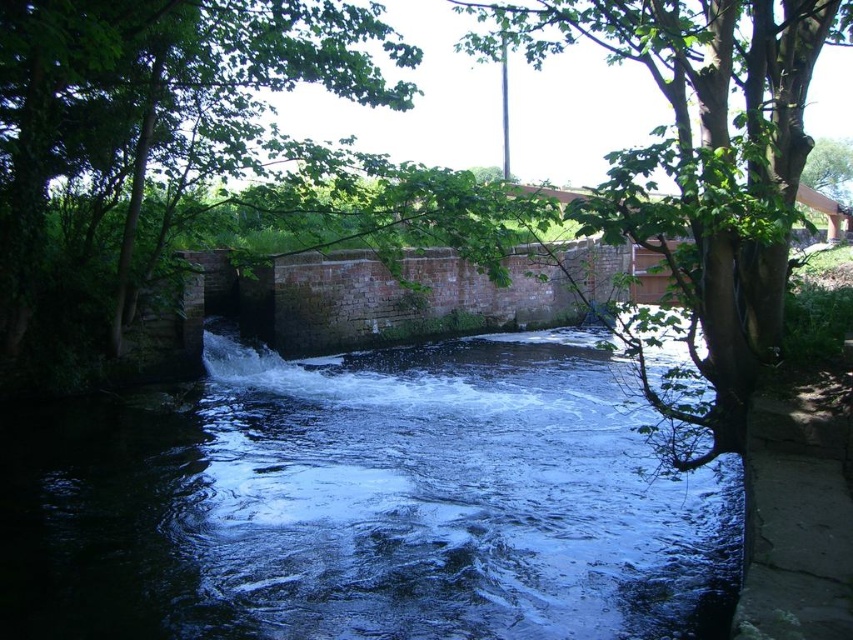
You are standing at the edge of the waterway and want to determine the relative positions of two points marked in the scene. Which point, point (585, 374) or point (712, 104), is closer to you?

Point (585, 374) is closer to you because it is further to the viewer than point (712, 104).

In the serene natural scene described, how does the area covered by the dark blue water at center compare to that of the green leafy tree at upper right?

The dark blue water at center occupies less space than the green leafy tree at upper right.

You are planning to build a small wooden bridge over the dark blue water at center. Considering the width of the green leafy tree at upper right, do you think the bridge will need to be wider than the tree?

The dark blue water at center is narrower than the green leafy tree at upper right, so the bridge only needs to span the waterway, which is narrower than the tree. Therefore, the bridge does not need to be wider than the green leafy tree at upper right.